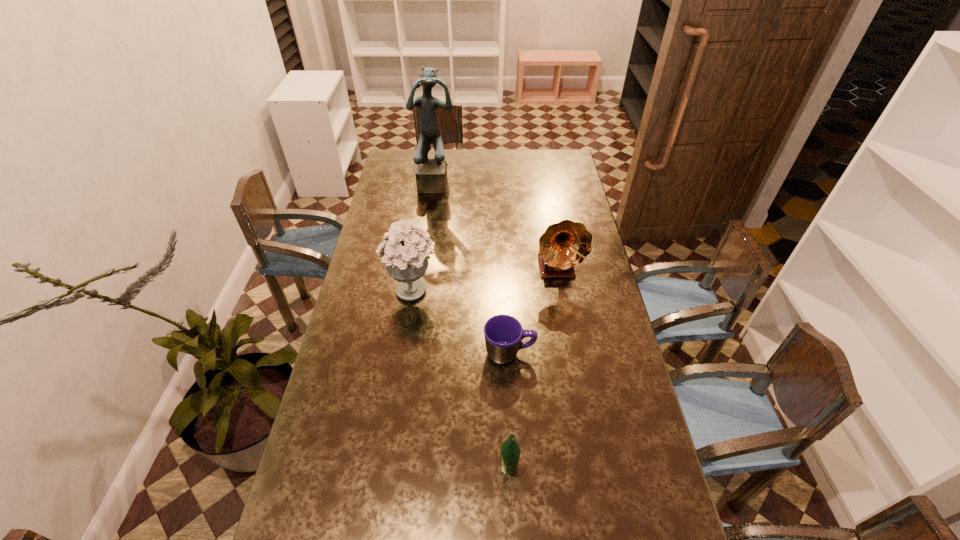
The height and width of the screenshot is (540, 960). In order to click on vacant point located 0.160m on the horn of the rightmost object in this screenshot , I will do `click(565, 321)`.

Image resolution: width=960 pixels, height=540 pixels. Find the location of `free space located on the right of the bottle`. free space located on the right of the bottle is located at coordinates (629, 466).

At what (x,y) coordinates should I click in order to perform the action: click on vacant area situated with the handle on the side of the shortest object. Please return your answer as a coordinate pair (x, y). Looking at the image, I should click on (601, 353).

The width and height of the screenshot is (960, 540). Identify the location of object that is at the far edge. (431, 174).

At what (x,y) coordinates should I click in order to perform the action: click on sculpture present at the left edge. Please return your answer as a coordinate pair (x, y). The width and height of the screenshot is (960, 540). Looking at the image, I should click on (431, 174).

Where is `bouquet situated at the left edge`? Image resolution: width=960 pixels, height=540 pixels. bouquet situated at the left edge is located at coordinates (405, 254).

Image resolution: width=960 pixels, height=540 pixels. I want to click on object located at the right edge, so click(566, 244).

Identify the location of object that is at the far left corner. This screenshot has height=540, width=960. (431, 174).

In the image, there is a desktop. In order to click on free space at the left edge in this screenshot , I will do `click(399, 198)`.

In the image, there is a desktop. Where is `free region at the right edge`? This screenshot has height=540, width=960. free region at the right edge is located at coordinates (x=581, y=200).